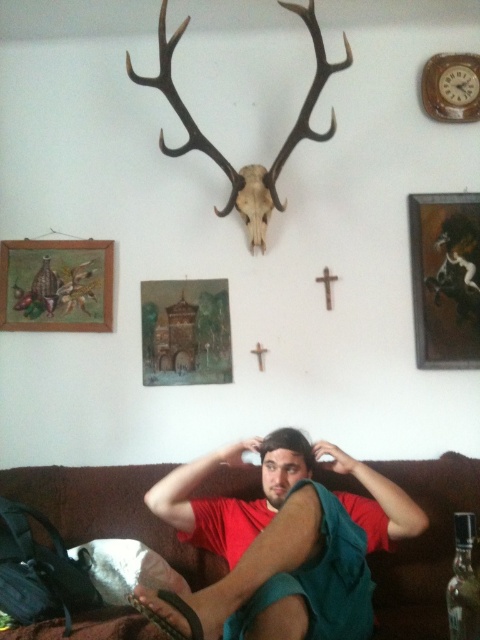
Question: Among these points, which one is nearest to the camera?

Choices:
 (A) (300, 448)
 (B) (435, 232)
 (C) (23, 307)

Answer: (A)

Question: Among these objects, which one is nearest to the camera?

Choices:
 (A) red matte shirt at center
 (B) brown matte antler at upper center
 (C) wooden framed painting at upper right

Answer: (A)

Question: Is wooden framed artwork at left positioned in front of brown matte antler at upper center?

Choices:
 (A) no
 (B) yes

Answer: (A)

Question: Is brown matte antler at upper center thinner than matte red shirt at center?

Choices:
 (A) no
 (B) yes

Answer: (A)

Question: Which point is farther from the camera taking this photo?

Choices:
 (A) (267, 486)
 (B) (189, 476)
 (C) (9, 253)
 (D) (302, 12)

Answer: (C)

Question: Considering the relative positions of wooden framed painting at upper right and brown matte antler at upper center in the image provided, where is wooden framed painting at upper right located with respect to brown matte antler at upper center?

Choices:
 (A) right
 (B) left

Answer: (A)